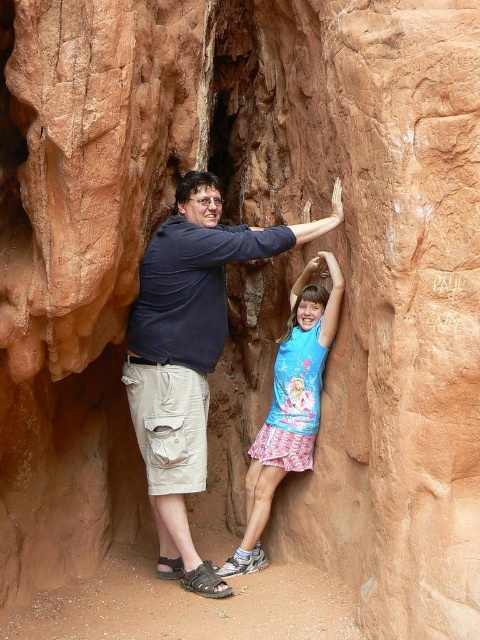
How much distance is there between matte blue shirt at center and blue printed shirt at center?

matte blue shirt at center is 17.13 inches away from blue printed shirt at center.

In the scene shown: Is matte blue shirt at center to the right of blue printed shirt at center from the viewer's perspective?

In fact, matte blue shirt at center is to the left of blue printed shirt at center.

Who is more distant from viewer, (165, 333) or (280, 374)?

Point (280, 374)

Where is `matte blue shirt at center`? The width and height of the screenshot is (480, 640). matte blue shirt at center is located at coordinates (189, 353).